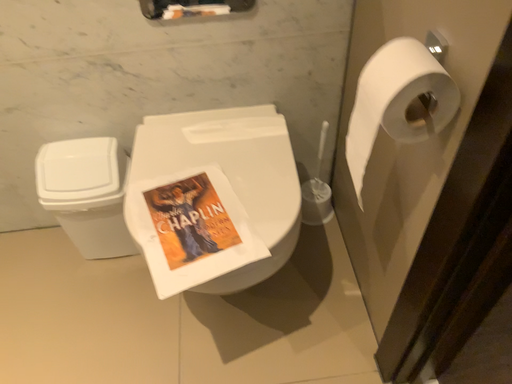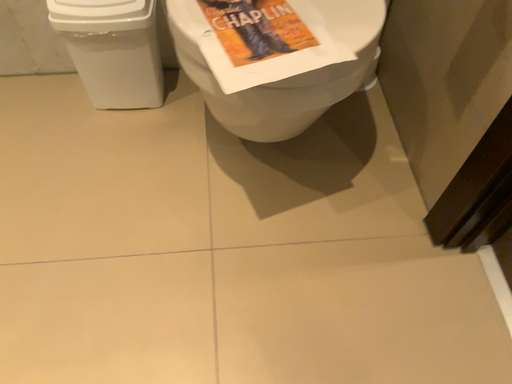
Question: How did the camera likely rotate when shooting the video?

Choices:
 (A) rotated downward
 (B) rotated upward

Answer: (A)